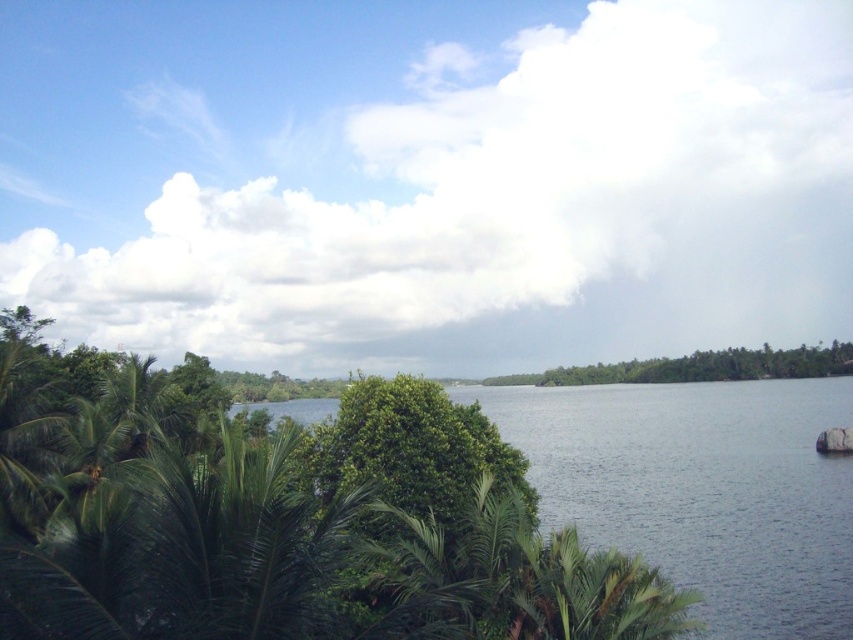
You are standing at the center of the lake and see two points marked in the image. Which point is closer to you, point (318, 419) or point (381, 480)?

Point (318, 419) is further to the viewer than point (381, 480), so the closer point to you is point (381, 480).

You are standing at the center of the image and want to locate the green leafy tree at center. According to the coordinates provided, in which direction should you look to find it?

The green leafy tree at center is located at point coordinates, so you should look towards the center of the image to find it.

You are standing in the middle of the scene and want to walk towards the green leafy trees at center. Which direction should you go to avoid the dark blue water at center?

The dark blue water at center is closer to the viewer than the green leafy trees at center, so you should walk towards the direction away from the dark blue water at center to reach the green leafy trees at center.